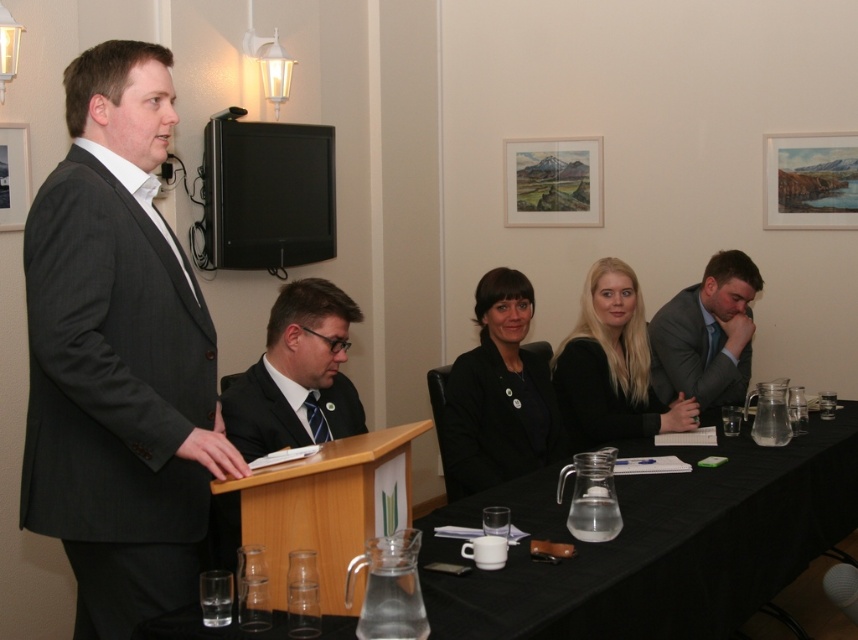
Can you confirm if clear glass table at center is shorter than black matte business suit at center?

In fact, clear glass table at center may be taller than black matte business suit at center.

This screenshot has height=640, width=858. Identify the location of clear glass table at center. (656, 544).

Measure the distance between point (689, 572) and camera.

A distance of 2.07 meters exists between point (689, 572) and camera.

Identify the location of clear glass table at center. (x=656, y=544).

Is matte black suit at right smaller than black matte business suit at center?

No.

Between matte black suit at right and black matte business suit at center, which one appears on the right side from the viewer's perspective?

matte black suit at right is more to the right.

Is point (724, 284) behind point (624, 352)?

Yes.

This screenshot has height=640, width=858. I want to click on matte black suit at right, so click(x=705, y=336).

You are a GUI agent. You are given a task and a screenshot of the screen. Output one action in this format:
    pyautogui.click(x=<x>, y=<y>)
    Task: Click on the wooden podium at center
    The image size is (858, 640).
    Given the screenshot: What is the action you would take?
    pyautogui.click(x=328, y=508)

Who is more distant from viewer, (x=279, y=547) or (x=345, y=326)?

The point (x=345, y=326) is more distant.

Who is more forward, (364, 502) or (291, 432)?

Positioned in front is point (364, 502).

Locate an element on the screen. wooden podium at center is located at coordinates (328, 508).